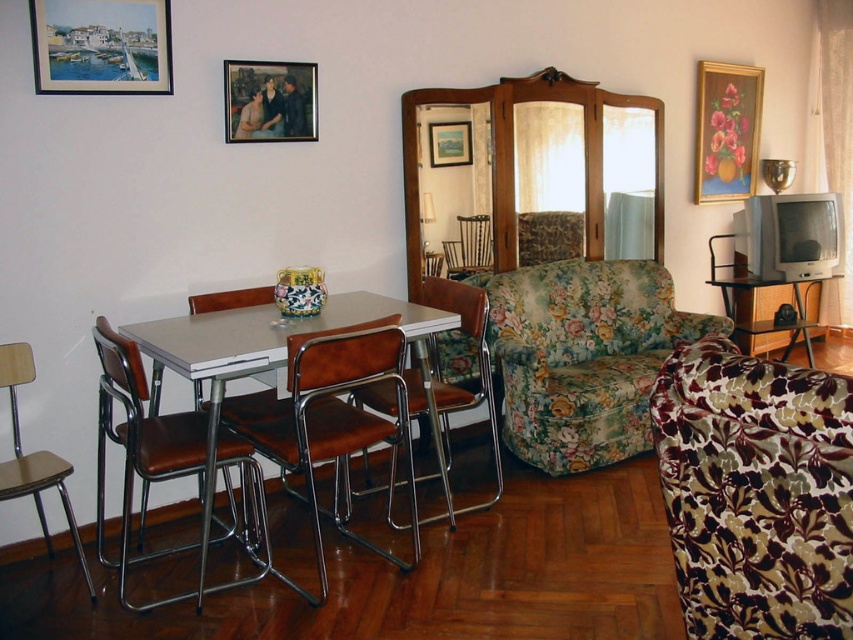
You are standing in the living room and want to place a small plant on the floor between the brown leather chair at left and the wooden picture frame at upper left. Which object should you move closer to the wall to make space?

To make space for the plant, you should move the brown leather chair at left closer to the wall since it is closer to the viewer than the wooden picture frame at upper left.

You are planning to rearrange the furniture in this retro living room. You need to place a new coffee table between the floral fabric couch at center and the wooden picture frame at center. Which object should the coffee table be closer to, considering their sizes?

The coffee table should be closer to the wooden picture frame at center because the floral fabric couch at center is larger in size than the wooden picture frame at center, so the smaller frame would require less space between them.